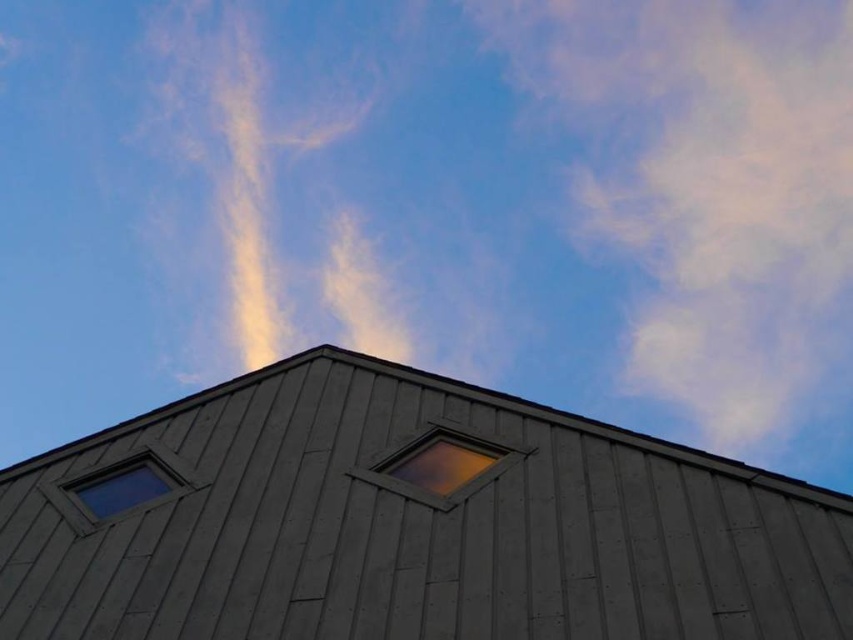
Based on the photo, you are standing on the ground looking at the gray wood roof at center. If you have a ladder that is 15 feet long, will it be long enough to reach the roof?

The distance between you and the gray wood roof at center is 16.01 feet, so a 15 feet ladder is not long enough to reach the roof.

Consider the image. You are a painter standing on a ladder to paint the gray wood roof at center and the matte wooden window at center. Which object will require you to climb higher on the ladder?

The gray wood roof at center is much taller than the matte wooden window at center, so you will need to climb higher on the ladder to reach the gray wood roof at center.

In the scene shown: You are a window cleaner standing on a ladder. You need to clean the transparent glass window at lower left and the gray wood roof at center. Given that your ladder can only reach up to 36 inches, can you safely clean both without moving the ladder?

The gray wood roof at center is 38.10 inches from the transparent glass window at lower left. Since the ladder can only reach 36 inches, you cannot safely clean both without moving the ladder because the distance between them exceeds the ladder reach.